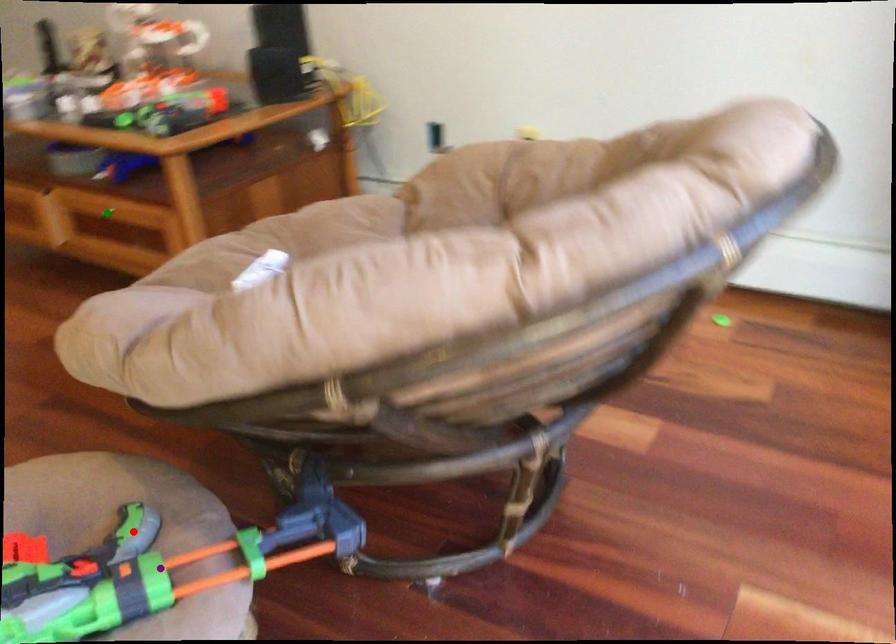
From the picture: Order these from nearest to farthest:
- green point
- purple point
- red point

green point
red point
purple point